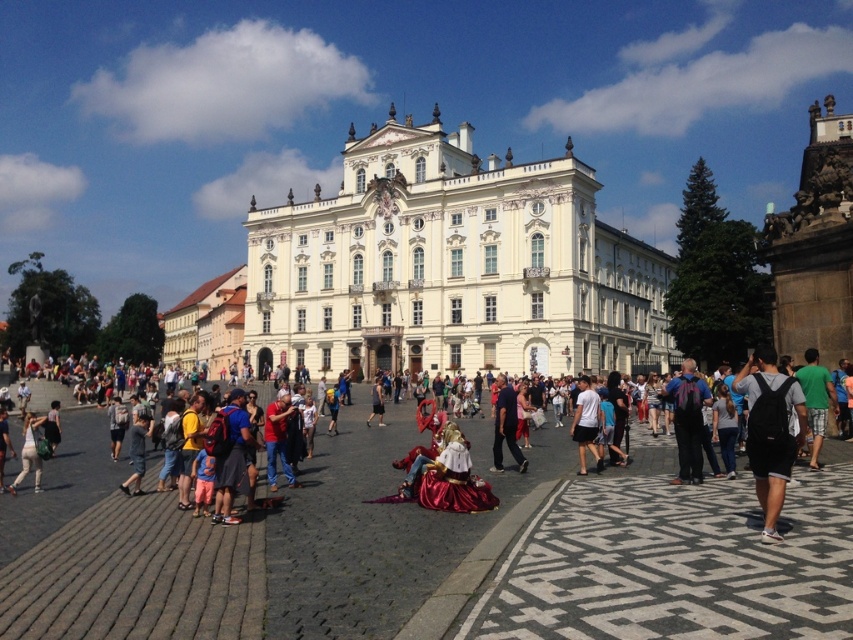
You are standing in front of the grand building and want to walk to the smooth stone pavement at center. According to the coordinates provided, in which direction should you move from your current position at the entrance?

The smooth stone pavement at center is located at coordinates point (x=430, y=552), so you should move towards the center of the plaza from the entrance to reach it.

You are standing in the plaza in front of the grand building and want to place your black backpack at lower right on the smooth stone pavement at center. Will the backpack fit on the pavement without hanging over the edges?

The smooth stone pavement at center is not as tall as black backpack at lower right, so the backpack will hang over the edges and won